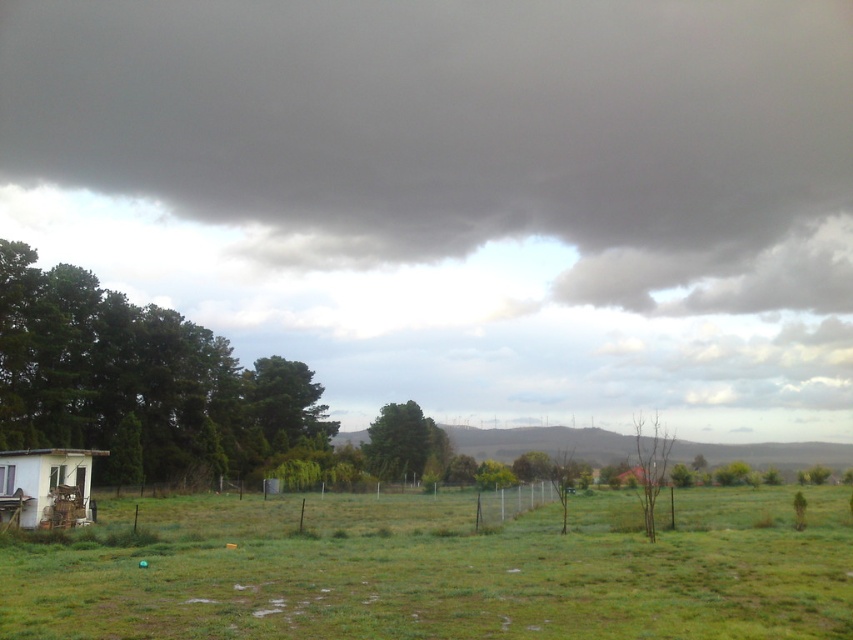
You are standing at the center of the field in the image. There are two points marked in the scene. Which point, point (x=171, y=397) or point (x=643, y=420), is closer to you?

Point (x=171, y=397) is closer to the camera than point (x=643, y=420), so it is closer to you.